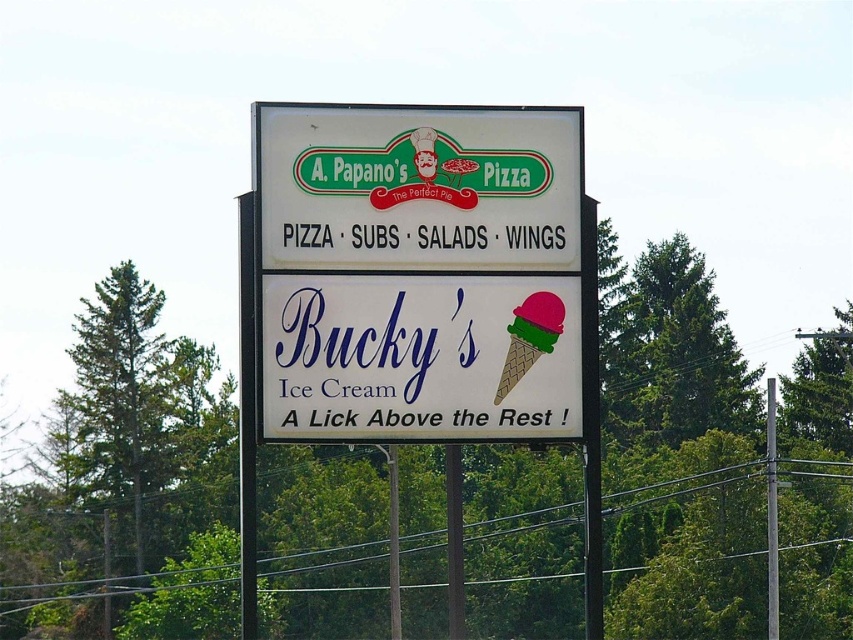
Consider the image. You are a customer looking at the double sided signboard for A. Papano Pizza and Bucky Ice Cream. You see a white paper sign at center and a white plastic sign at center. Which one is smaller in size?

The white paper sign at center is smaller in size than the white plastic sign at center because it occupies less space.

You are standing at the point marked at coordinates (439,124). You want to walk directly to the signboard for A. Papano Pizza. How far will you have to walk?

You will have to walk 56.55 meters to reach the signboard for A. Papano Pizza from the point marked at coordinates (439,124).

You are standing in front of the double sided signboard for A. Papano Pizza and Bucky Ice Cream. You see a white paper sign at center and a white plastic sign at center. Which one is shorter in height?

The white paper sign at center is shorter in height compared to the white plastic sign at center.